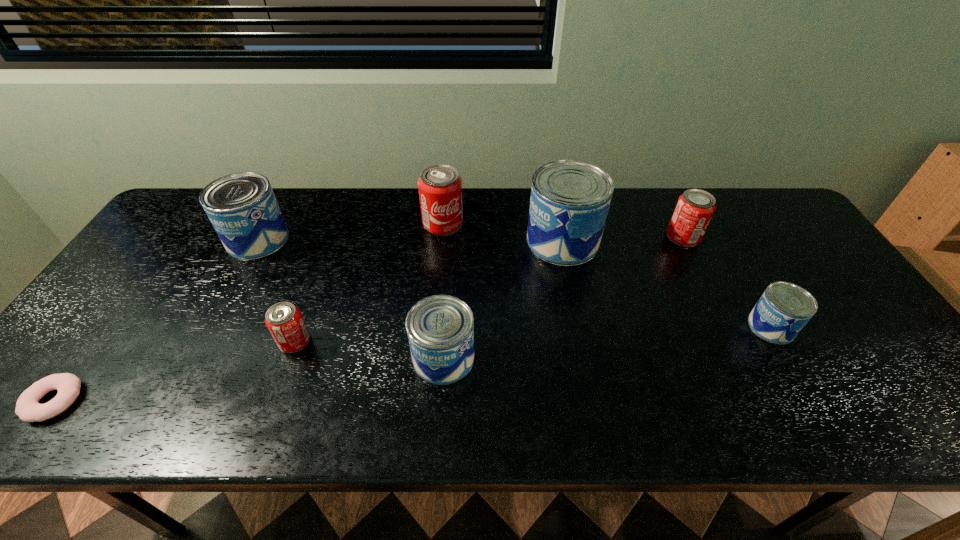
Identify the location of vacant area located 0.130m on the front label of the second blue can from left to right. This screenshot has width=960, height=540. (530, 358).

Locate an element on the screen. free space located 0.130m on the back of the nearest red can is located at coordinates click(x=313, y=290).

What are the coordinates of `free space located on the front label of the rightmost can` in the screenshot? It's located at (657, 327).

Where is `free space located 0.340m on the front label of the rightmost can`? Image resolution: width=960 pixels, height=540 pixels. free space located 0.340m on the front label of the rightmost can is located at coordinates (612, 327).

Locate an element on the screen. vacant space located on the front label of the rightmost can is located at coordinates (636, 327).

You are a GUI agent. You are given a task and a screenshot of the screen. Output one action in this format:
    pyautogui.click(x=<x>, y=<y>)
    Task: Click on the free region located 0.110m on the back of the doughnut
    The height and width of the screenshot is (540, 960).
    Given the screenshot: What is the action you would take?
    pyautogui.click(x=100, y=338)

Image resolution: width=960 pixels, height=540 pixels. I want to click on object present at the near edge, so click(x=28, y=409).

Where is `object present at the left edge`? The height and width of the screenshot is (540, 960). object present at the left edge is located at coordinates (28, 409).

I want to click on object located at the near left corner, so click(28, 409).

Locate an element on the screen. blank space at the far edge of the desktop is located at coordinates (513, 211).